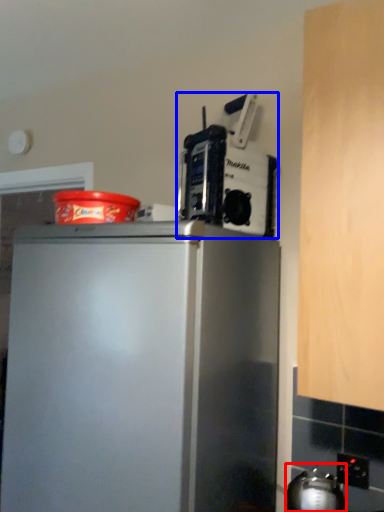
Question: Which object appears farthest to the camera in this image, appliance (highlighted by a red box) or kitchen appliance (highlighted by a blue box)?

Choices:
 (A) appliance
 (B) kitchen appliance

Answer: (B)